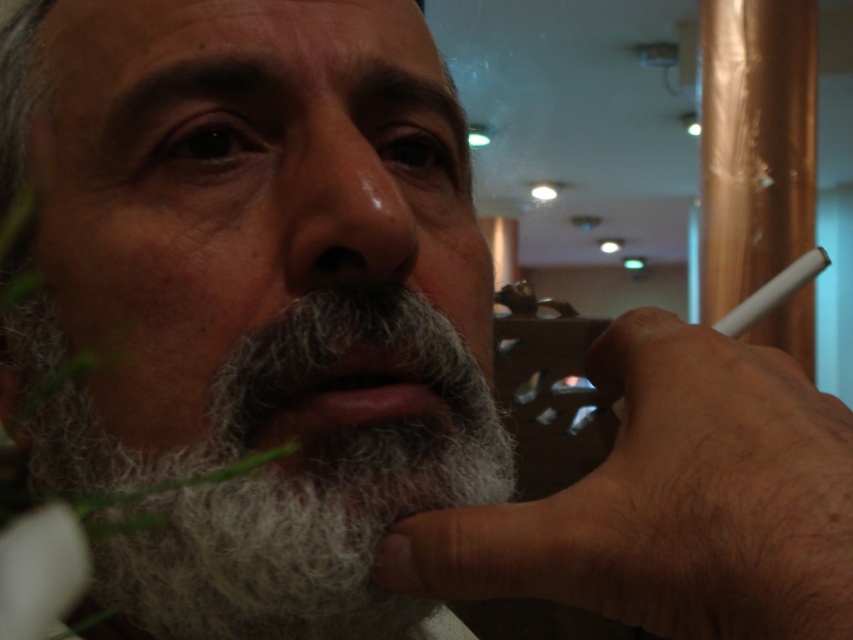
Question: Can you confirm if gray fuzzy beard at lower left is smaller than dry matte nose at center?

Choices:
 (A) no
 (B) yes

Answer: (A)

Question: Which point is closer to the camera?

Choices:
 (A) dry matte nose at center
 (B) gray fuzzy beard at lower left

Answer: (A)

Question: Does gray fuzzy beard at lower left lie behind dry matte nose at center?

Choices:
 (A) no
 (B) yes

Answer: (B)

Question: Does gray fuzzy beard at lower left have a larger size compared to dry matte nose at center?

Choices:
 (A) no
 (B) yes

Answer: (B)

Question: Which point is closer to the camera taking this photo?

Choices:
 (A) (311, 369)
 (B) (409, 218)

Answer: (B)